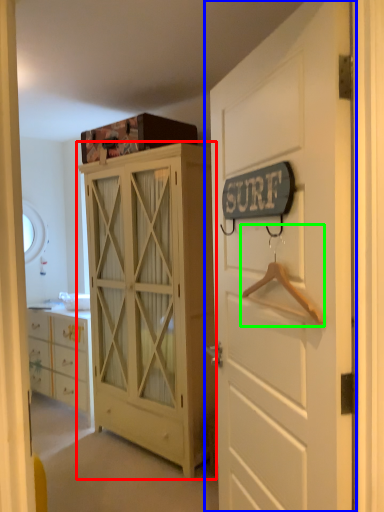
Question: Estimate the real-world distances between objects in this image. Which object is closer to cabinetry (highlighted by a red box), door (highlighted by a blue box) or hanger (highlighted by a green box)?

Choices:
 (A) door
 (B) hanger

Answer: (A)